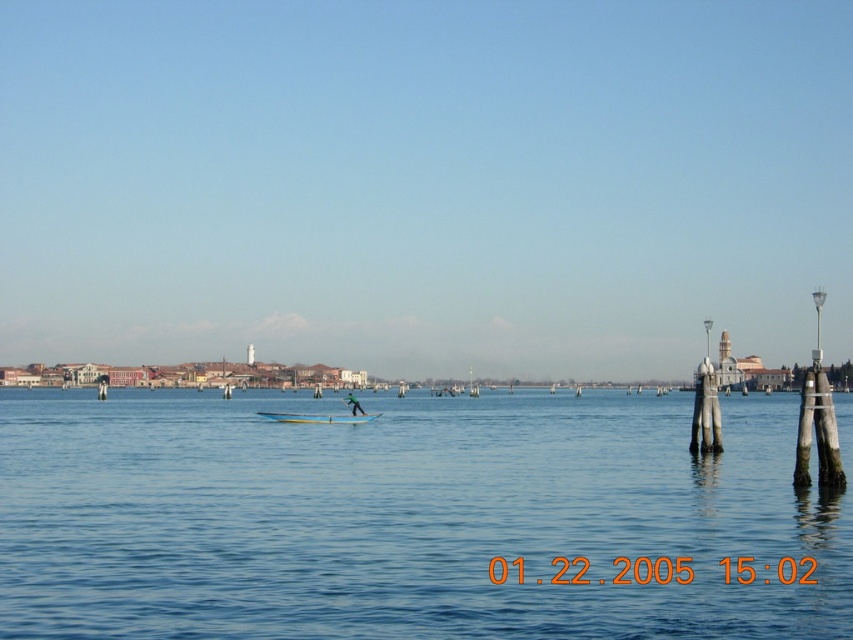
Can you confirm if blue water at center is wider than green fabric person at center?

Yes, blue water at center is wider than green fabric person at center.

Which is behind, point (798, 624) or point (346, 396)?

The point (346, 396) is more distant.

Which is in front, point (15, 529) or point (352, 410)?

Point (15, 529)

At what (x,y) coordinates should I click in order to perform the action: click on blue water at center. Please return your answer as a coordinate pair (x, y). This screenshot has height=640, width=853. Looking at the image, I should click on (405, 516).

Can you confirm if blue water at center is positioned above white glossy canoe at center?

No.

Is point (202, 593) positioned in front of point (329, 413)?

Yes, point (202, 593) is closer to viewer.

The width and height of the screenshot is (853, 640). I want to click on blue water at center, so click(405, 516).

Between white glossy canoe at center and green fabric person at center, which one has more height?

With more height is green fabric person at center.

Does point (323, 417) come closer to viewer compared to point (352, 410)?

No, (323, 417) is behind (352, 410).

I want to click on white glossy canoe at center, so click(x=317, y=417).